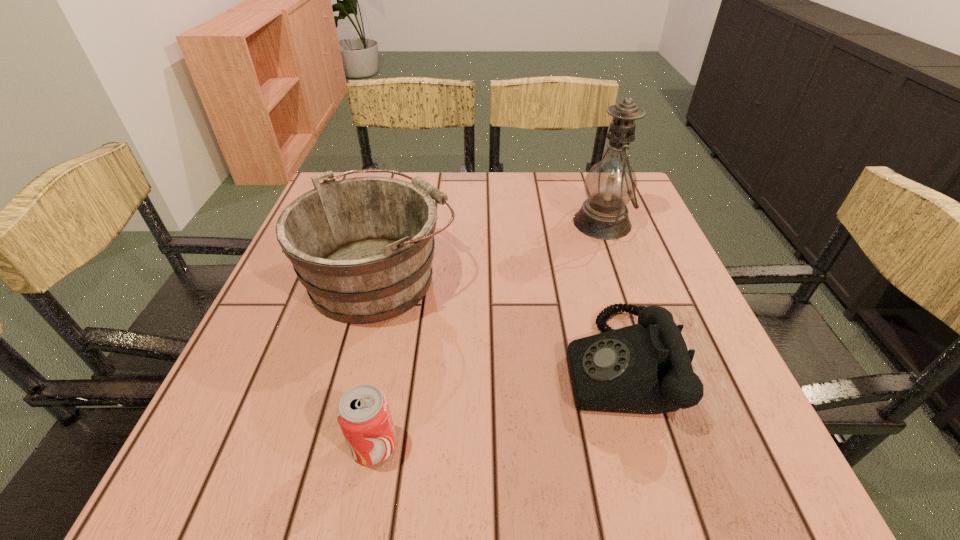
This screenshot has width=960, height=540. Identify the location of oil lamp. (610, 184).

Where is `wine bucket`? The width and height of the screenshot is (960, 540). wine bucket is located at coordinates (362, 247).

I want to click on telephone, so (x=646, y=368).

Identify the location of soda can. Image resolution: width=960 pixels, height=540 pixels. (363, 413).

Locate an element on the screen. The image size is (960, 540). blank space located on the back of the oil lamp is located at coordinates (588, 184).

You are a GUI agent. You are given a task and a screenshot of the screen. Output one action in this format:
    pyautogui.click(x=<x>, y=<y>)
    Task: Click on the vacant space located on the back of the second tallest object
    
    Given the screenshot: What is the action you would take?
    pyautogui.click(x=403, y=184)

Locate an element on the screen. This screenshot has height=540, width=960. free space located 0.400m on the dial of the telephone is located at coordinates (347, 363).

Locate an element on the screen. The height and width of the screenshot is (540, 960). free spot located 0.270m on the dial of the telephone is located at coordinates (419, 363).

The image size is (960, 540). I want to click on free space located 0.350m on the dial of the telephone, so point(374,363).

Locate an element on the screen. vacant space located on the back of the soda can is located at coordinates (404, 285).